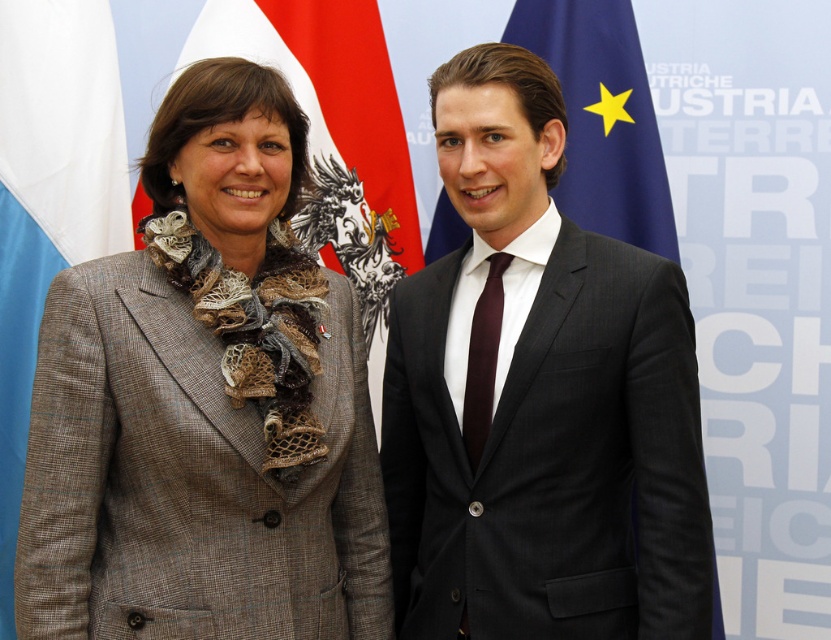
You are standing in front of the image and want to know how far the point at coordinates point (494, 420) is from you. Can you determine the distance?

The point (494, 420) is 5.21 feet away from the viewer.

You are a photographer setting up for a group photo. You need to position the plaid wool coat at center and the dark gray suit at center so that both are visible in the frame. Based on their current positions, which one is lower in the image?

The plaid wool coat at center is located below the dark gray suit at center, so the plaid wool coat at center is lower in the image.

You are a photographer setting up for a group photo. You need to ensure that the dark gray suit at center and the red fabric flag at upper left are both clearly visible in the frame. Given that your camera has a maximum focus range of 25 inches, will you need to adjust your position or equipment to capture both subjects within the focus range?

The distance between the dark gray suit at center and the red fabric flag at upper left is 26.82 inches, which exceeds the camera maximum focus range of 25 inches. Therefore, you will need to adjust your position or equipment to ensure both are within the focus range.